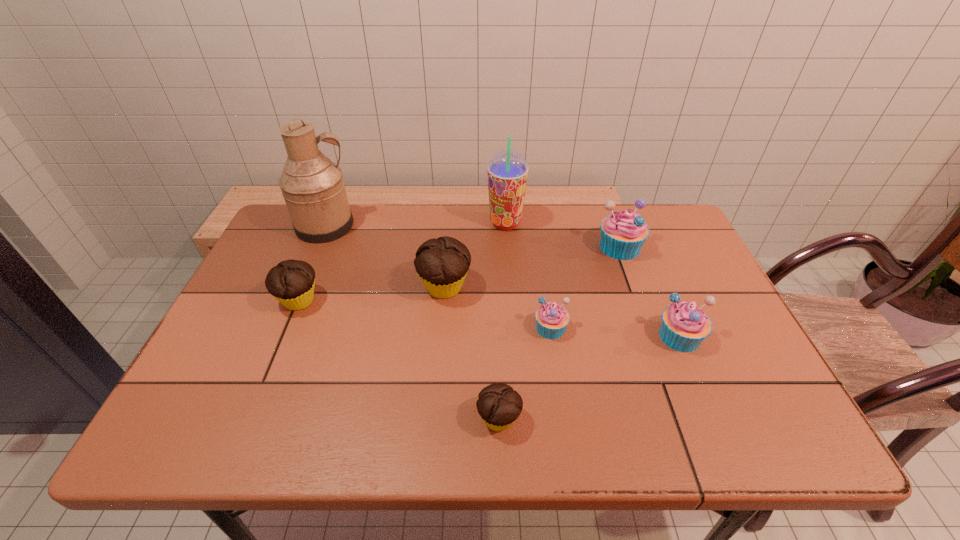
The height and width of the screenshot is (540, 960). What are the coordinates of `empty location between the pitcher and the second tallest object` in the screenshot? It's located at (416, 225).

Select which object is the seventh closest to the second smallest blue muffin. Please provide its 2D coordinates. Your answer should be formatted as a tuple, i.e. [(x, y)], where the tuple contains the x and y coordinates of a point satisfying the conditions above.

[(313, 188)]

Where is `object that is the fourth closest to the fifth muffin from right to left`? object that is the fourth closest to the fifth muffin from right to left is located at coordinates (313, 188).

Locate which muffin is the fourth closest to the seventh shortest object. Please provide its 2D coordinates. Your answer should be formatted as a tuple, i.e. [(x, y)], where the tuple contains the x and y coordinates of a point satisfying the conditions above.

[(684, 326)]

Identify which muffin is located as the third nearest to the seventh shortest object. Please provide its 2D coordinates. Your answer should be formatted as a tuple, i.e. [(x, y)], where the tuple contains the x and y coordinates of a point satisfying the conditions above.

[(552, 319)]

Locate which blue muffin ranks second in proximity to the farthest muffin. Please provide its 2D coordinates. Your answer should be formatted as a tuple, i.e. [(x, y)], where the tuple contains the x and y coordinates of a point satisfying the conditions above.

[(552, 319)]

Image resolution: width=960 pixels, height=540 pixels. I want to click on blue muffin that can be found as the second closest to the biggest blue muffin, so click(x=552, y=319).

This screenshot has width=960, height=540. I want to click on the third closest chocolate muffin to the biggest blue muffin, so click(x=291, y=282).

Locate an element on the screen. The height and width of the screenshot is (540, 960). chocolate muffin that can be found as the closest to the farthest blue muffin is located at coordinates (442, 264).

Locate an element on the screen. This screenshot has width=960, height=540. free space in the image that satisfies the following two spatial constraints: 1. on the front side of the biggest blue muffin; 2. on the left side of the second biggest blue muffin is located at coordinates (653, 336).